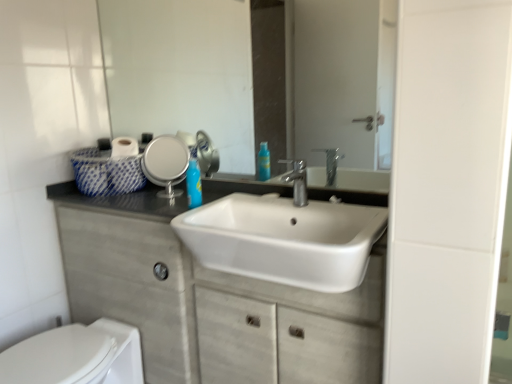
Question: Is white matte cabinet at center outside of clear glass mirror at upper center?

Choices:
 (A) no
 (B) yes

Answer: (B)

Question: Considering the relative sizes of white matte cabinet at center and clear glass mirror at upper center in the image provided, is white matte cabinet at center taller than clear glass mirror at upper center?

Choices:
 (A) no
 (B) yes

Answer: (B)

Question: From the image's perspective, would you say white matte cabinet at center is shown under clear glass mirror at upper center?

Choices:
 (A) no
 (B) yes

Answer: (B)

Question: Can you confirm if white matte cabinet at center is bigger than clear glass mirror at upper center?

Choices:
 (A) yes
 (B) no

Answer: (A)

Question: Considering the relative sizes of white matte cabinet at center and clear glass mirror at upper center in the image provided, is white matte cabinet at center smaller than clear glass mirror at upper center?

Choices:
 (A) no
 (B) yes

Answer: (A)

Question: Is white matte cabinet at center positioned with its back to clear glass mirror at upper center?

Choices:
 (A) yes
 (B) no

Answer: (B)

Question: Is silver metallic faucet at center positioned in front of clear glass mirror at upper center?

Choices:
 (A) yes
 (B) no

Answer: (A)

Question: Does silver metallic faucet at center appear on the left side of clear glass mirror at upper center?

Choices:
 (A) yes
 (B) no

Answer: (B)

Question: From the image's perspective, would you say silver metallic faucet at center is shown under clear glass mirror at upper center?

Choices:
 (A) no
 (B) yes

Answer: (B)

Question: Does silver metallic faucet at center come behind clear glass mirror at upper center?

Choices:
 (A) no
 (B) yes

Answer: (A)

Question: Considering the relative sizes of silver metallic faucet at center and clear glass mirror at upper center in the image provided, is silver metallic faucet at center bigger than clear glass mirror at upper center?

Choices:
 (A) no
 (B) yes

Answer: (A)

Question: From a real-world perspective, is silver metallic faucet at center positioned over clear glass mirror at upper center based on gravity?

Choices:
 (A) yes
 (B) no

Answer: (B)

Question: From the image's perspective, is white glossy toilet at lower left below clear glass mirror at upper center?

Choices:
 (A) no
 (B) yes

Answer: (B)